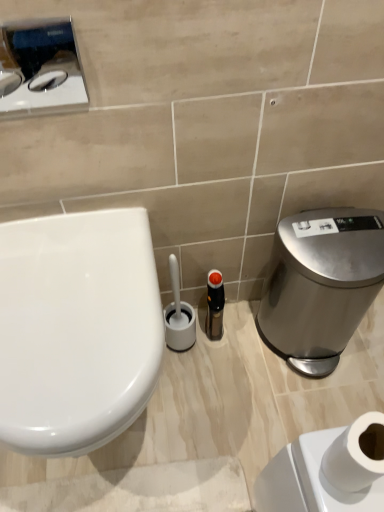
In order to click on vacant space in front of satin silver trash can at right in this screenshot , I will do `click(301, 408)`.